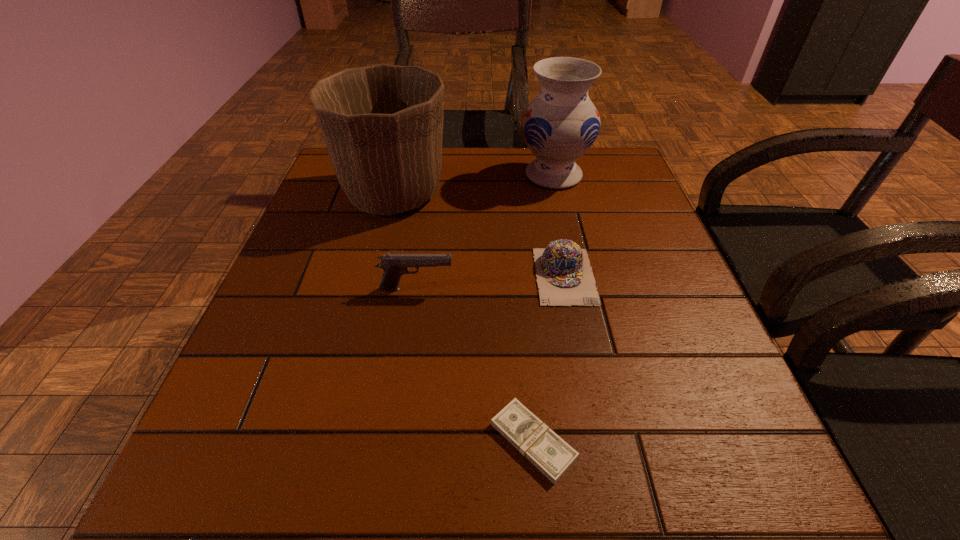
In the image, there is a desktop. At what (x,y) coordinates should I click in order to perform the action: click on vacant space at the left edge. Please return your answer as a coordinate pair (x, y). Image resolution: width=960 pixels, height=540 pixels. Looking at the image, I should click on (300, 226).

In the image, there is a desktop. Where is `free region at the right edge`? free region at the right edge is located at coordinates (652, 241).

Find the location of a particular element. The height and width of the screenshot is (540, 960). vacant space at the near left corner is located at coordinates (221, 517).

You are a GUI agent. You are given a task and a screenshot of the screen. Output one action in this format:
    pyautogui.click(x=<x>, y=<y>)
    Task: Click on the blank space at the far right corner of the desktop
    
    Given the screenshot: What is the action you would take?
    tap(603, 172)

This screenshot has height=540, width=960. What are the coordinates of `free space at the near right corner` in the screenshot? It's located at (768, 468).

At what (x,y) coordinates should I click in order to perform the action: click on free spot between the pistol and the second shortest object. Please return your answer as a coordinate pair (x, y). Looking at the image, I should click on (491, 282).

In order to click on unoccupied position between the flowerpot and the third shortest object in this screenshot , I will do point(405,241).

You are a GUI agent. You are given a task and a screenshot of the screen. Output one action in this format:
    pyautogui.click(x=<x>, y=<y>)
    Task: Click on the free spot between the pistol and the vase
    Image resolution: width=960 pixels, height=540 pixels.
    Given the screenshot: What is the action you would take?
    pyautogui.click(x=485, y=232)

The width and height of the screenshot is (960, 540). Identify the location of vacant space in between the cap and the third shortest object. (491, 282).

Locate an element on the screen. vacant region between the flowerpot and the money is located at coordinates (464, 318).